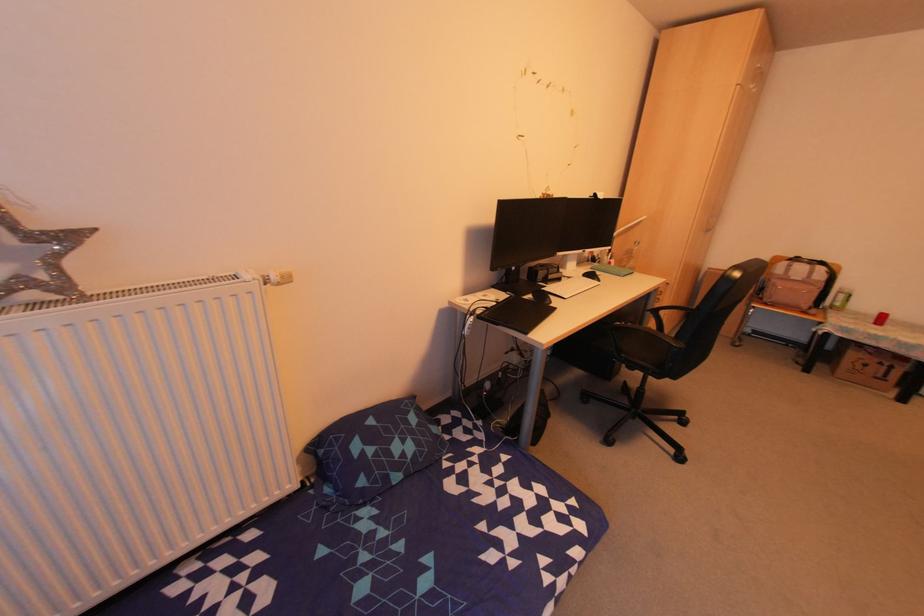
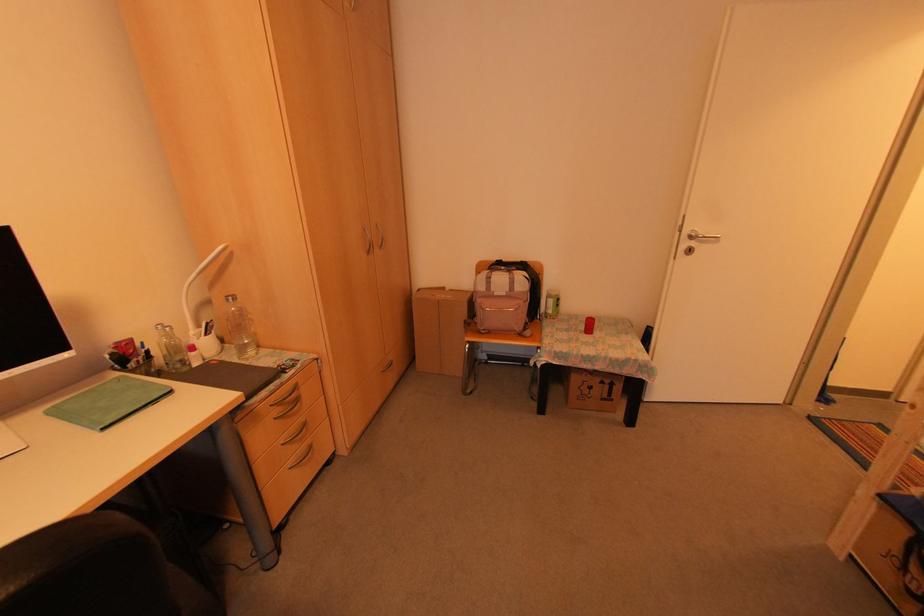
The point at (762,300) is marked in the first image. Where is the corresponding point in the second image?

(477, 326)